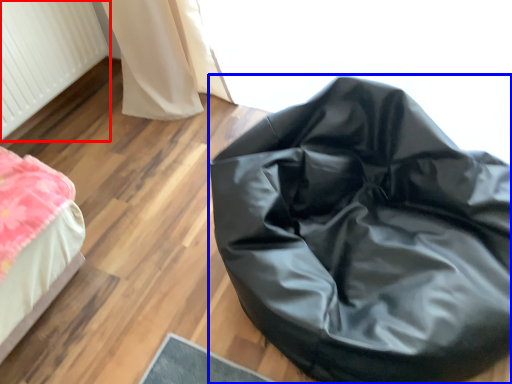
Question: Which object appears closest to the camera in this image, radiator (highlighted by a red box) or furniture (highlighted by a blue box)?

Choices:
 (A) radiator
 (B) furniture

Answer: (B)